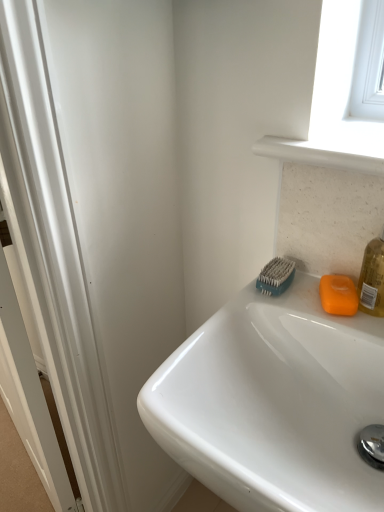
Question: Can you confirm if white glossy sink at upper right is positioned to the right of orange matte soap at right?

Choices:
 (A) no
 (B) yes

Answer: (A)

Question: Is white glossy sink at upper right outside of orange matte soap at right?

Choices:
 (A) no
 (B) yes

Answer: (B)

Question: Can you confirm if white glossy sink at upper right is taller than orange matte soap at right?

Choices:
 (A) no
 (B) yes

Answer: (B)

Question: Is white glossy sink at upper right oriented away from orange matte soap at right?

Choices:
 (A) yes
 (B) no

Answer: (B)

Question: From the image's perspective, is white glossy sink at upper right below orange matte soap at right?

Choices:
 (A) yes
 (B) no

Answer: (A)

Question: In terms of size, does orange matte soap at right appear bigger or smaller than white glossy sink at upper right?

Choices:
 (A) small
 (B) big

Answer: (A)

Question: Is point (334, 280) closer or farther from the camera than point (307, 413)?

Choices:
 (A) closer
 (B) farther

Answer: (B)

Question: Looking at their shapes, would you say orange matte soap at right is wider or thinner than white glossy sink at upper right?

Choices:
 (A) wide
 (B) thin

Answer: (B)

Question: In terms of height, does orange matte soap at right look taller or shorter compared to white glossy sink at upper right?

Choices:
 (A) tall
 (B) short

Answer: (B)

Question: In terms of width, does teal rubber brush at upper right look wider or thinner when compared to orange matte soap at right?

Choices:
 (A) thin
 (B) wide

Answer: (A)

Question: From a real-world perspective, is teal rubber brush at upper right positioned above or below orange matte soap at right?

Choices:
 (A) below
 (B) above

Answer: (B)

Question: Is teal rubber brush at upper right in front of or behind orange matte soap at right in the image?

Choices:
 (A) front
 (B) behind

Answer: (B)

Question: Based on their sizes in the image, would you say teal rubber brush at upper right is bigger or smaller than orange matte soap at right?

Choices:
 (A) small
 (B) big

Answer: (B)

Question: Is teal rubber brush at upper right situated inside white glossy sink at upper right or outside?

Choices:
 (A) outside
 (B) inside

Answer: (B)

Question: Is teal rubber brush at upper right in front of or behind white glossy sink at upper right in the image?

Choices:
 (A) behind
 (B) front

Answer: (A)